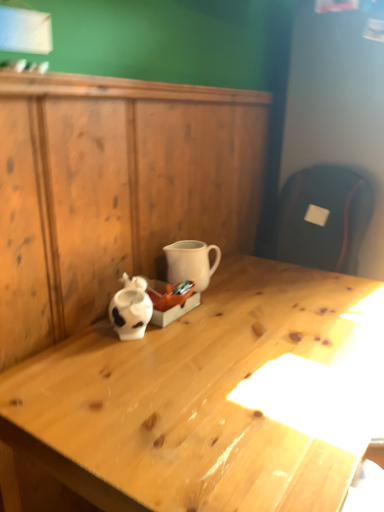
Question: Is the surface of white matte coffee cup at center in direct contact with wooden dresser at center?

Choices:
 (A) no
 (B) yes

Answer: (A)

Question: Is white matte coffee cup at center closer to camera compared to wooden dresser at center?

Choices:
 (A) no
 (B) yes

Answer: (A)

Question: From a real-world perspective, is white matte coffee cup at center physically below wooden dresser at center?

Choices:
 (A) no
 (B) yes

Answer: (A)

Question: Can you confirm if white matte coffee cup at center is positioned to the right of wooden dresser at center?

Choices:
 (A) yes
 (B) no

Answer: (B)

Question: Would you consider white matte coffee cup at center to be distant from wooden dresser at center?

Choices:
 (A) yes
 (B) no

Answer: (B)

Question: Does white matte coffee cup at center have a larger size compared to wooden dresser at center?

Choices:
 (A) yes
 (B) no

Answer: (B)

Question: Is light wood desk at center shorter than white matte coffee cup at center?

Choices:
 (A) yes
 (B) no

Answer: (B)

Question: From the image's perspective, is light wood desk at center below white matte coffee cup at center?

Choices:
 (A) no
 (B) yes

Answer: (B)

Question: From the image's perspective, is light wood desk at center over white matte coffee cup at center?

Choices:
 (A) yes
 (B) no

Answer: (B)

Question: From a real-world perspective, is light wood desk at center positioned over white matte coffee cup at center based on gravity?

Choices:
 (A) no
 (B) yes

Answer: (A)

Question: Would you say light wood desk at center is outside white matte coffee cup at center?

Choices:
 (A) no
 (B) yes

Answer: (B)

Question: Considering the relative positions of light wood desk at center and white matte coffee cup at center in the image provided, is light wood desk at center behind white matte coffee cup at center?

Choices:
 (A) yes
 (B) no

Answer: (B)

Question: Is light wood desk at center at the left side of wooden dresser at center?

Choices:
 (A) yes
 (B) no

Answer: (B)